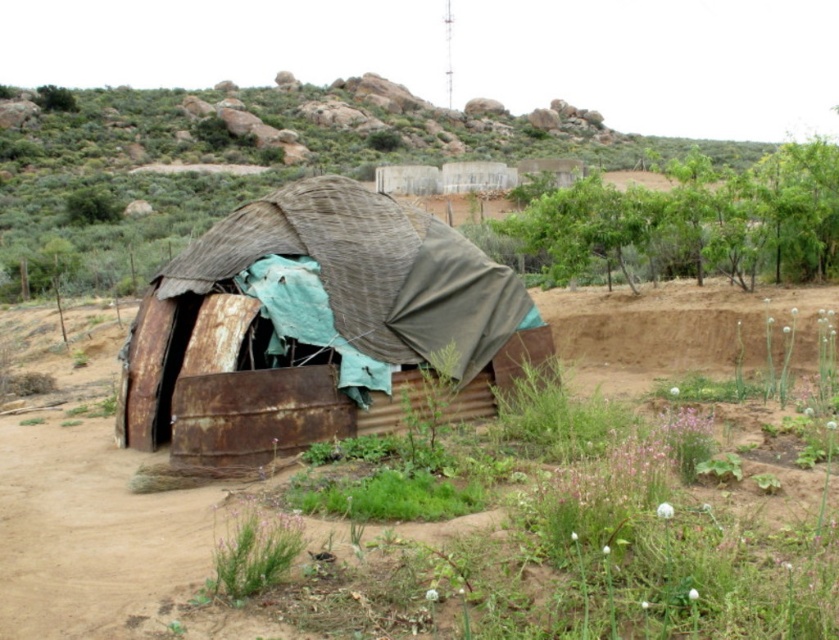
You are standing at the entrance of the rusty corrugated metal hut at center and want to walk towards the green leafy plants at upper right. In which direction should you move?

You should move to the right because the rusty corrugated metal hut at center is to the left of green leafy plants at upper right, so moving right will take you towards them.

You are a traveler who needs to set up a tent. You see the rusty corrugated metal hut at center and the green leafy plants at upper right. Which object is taller?

The green leafy plants at upper right are taller than the rusty corrugated metal hut at center.

You are planning to set up a small garden near the rusty corrugated metal hut at center and the green leafy plants at upper right. Which area has more space available for planting?

The green leafy plants at upper right have more space available for planting since the rusty corrugated metal hut at center occupies less space than them.